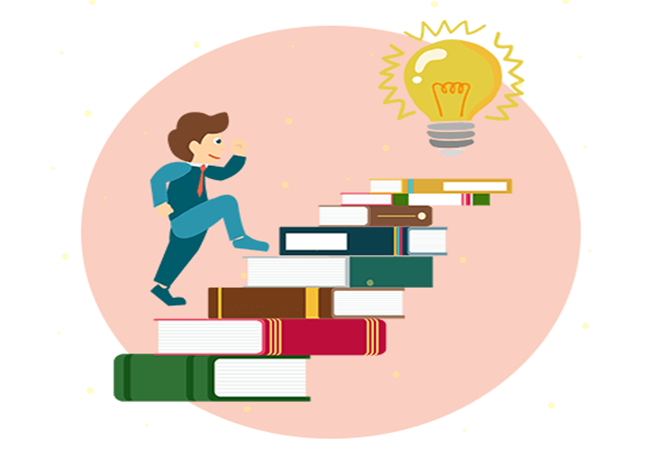
The height and width of the screenshot is (450, 650). What are the coordinates of `books as stairs` in the screenshot? It's located at (213, 377), (270, 341), (285, 303), (315, 266), (328, 238), (356, 216), (382, 193), (409, 184).